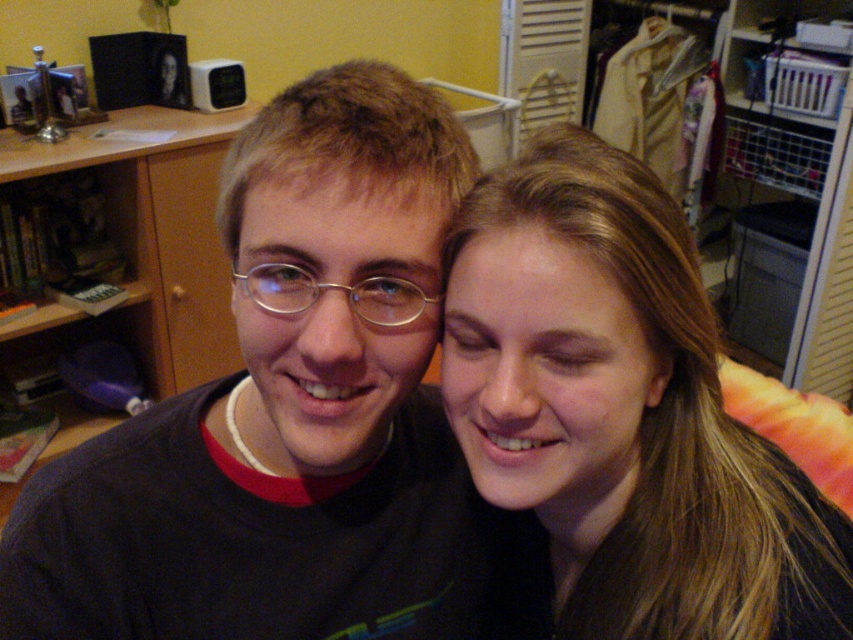
Question: Is smooth brown hair at right smaller than wooden bookshelf at left?

Choices:
 (A) yes
 (B) no

Answer: (A)

Question: Can you confirm if smooth brown hair at right is smaller than wooden bookshelf at left?

Choices:
 (A) yes
 (B) no

Answer: (A)

Question: Does smooth brown hair at right have a greater width compared to wooden bookshelf at left?

Choices:
 (A) no
 (B) yes

Answer: (A)